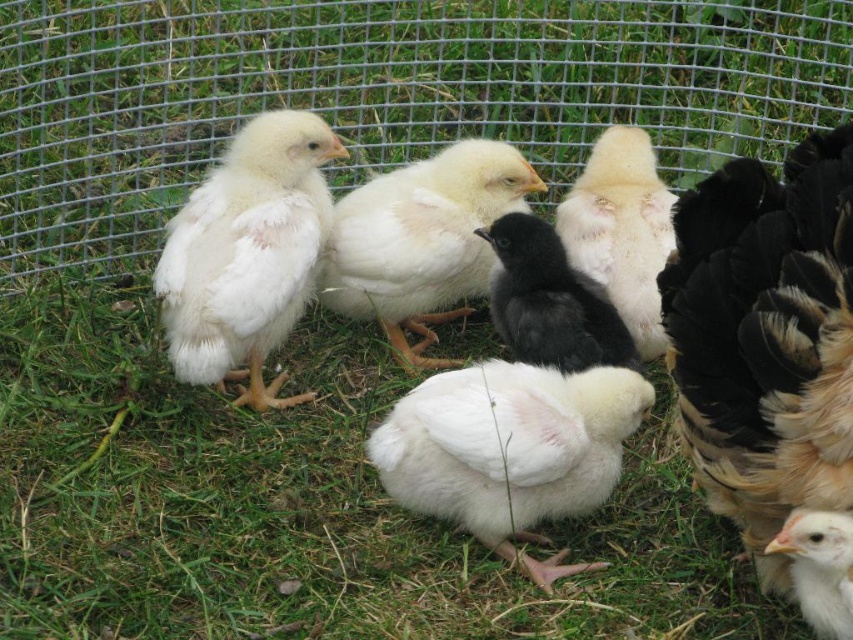
Question: Is black feathered chicken at right wider than white fluffy chicken at center?

Choices:
 (A) no
 (B) yes

Answer: (B)

Question: Is black feathered chicken at right positioned in front of fluffy white chick at center?

Choices:
 (A) no
 (B) yes

Answer: (B)

Question: Which of the following is the farthest from the observer?

Choices:
 (A) black feathered chicken at right
 (B) white fluffy chick at center
 (C) white fluffy chick at lower right
 (D) white fluffy chicken at center

Answer: (D)

Question: Can you confirm if black feathered chicken at right is positioned to the left of white fluffy chicken at center?

Choices:
 (A) no
 (B) yes

Answer: (A)

Question: Which is farther from the white fluffy chicken at center?

Choices:
 (A) black matte chicken at center
 (B) black feathered chicken at right

Answer: (B)

Question: Considering the real-world distances, which object is farthest from the green wire mesh at upper center?

Choices:
 (A) white fluffy chick at center
 (B) white fluffy chick at left

Answer: (A)